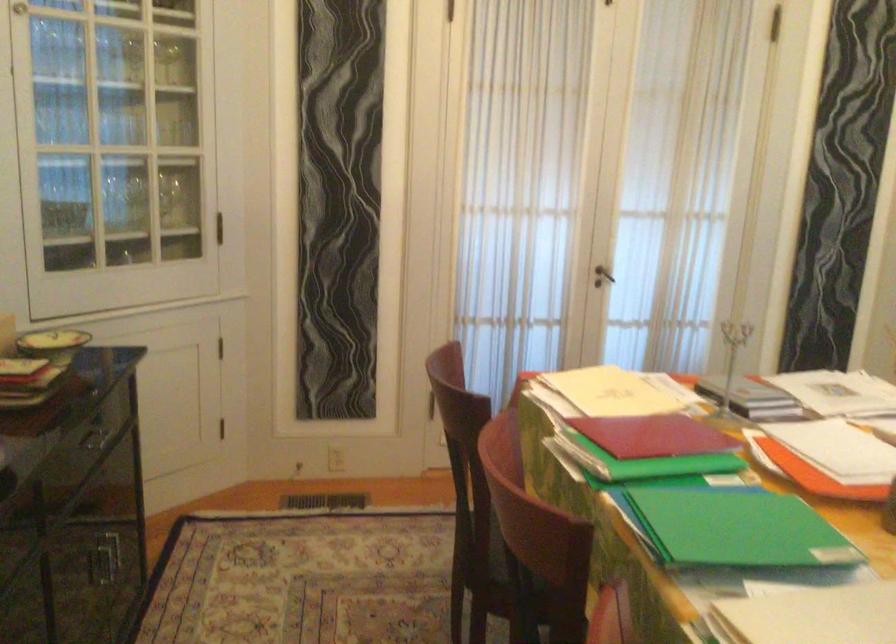
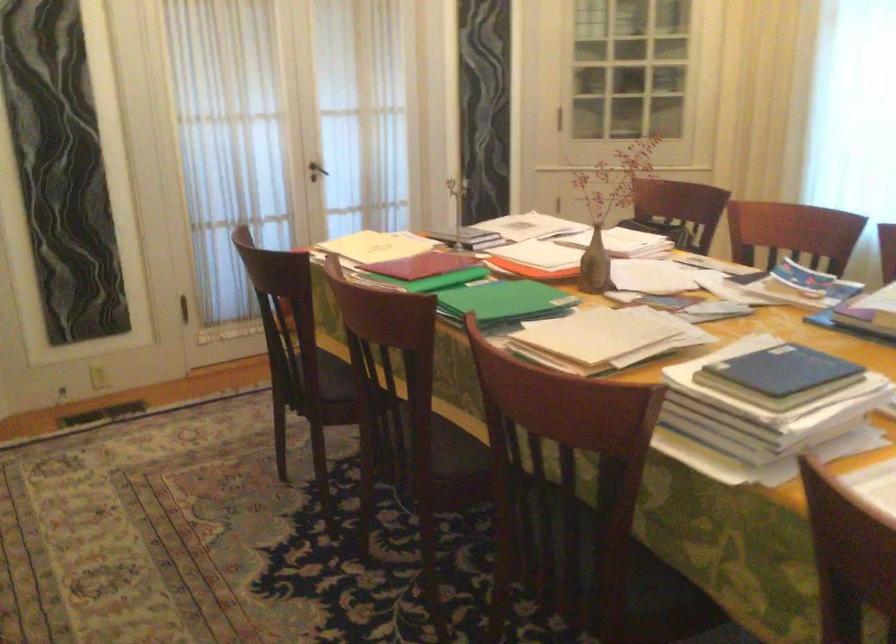
The point at (650, 437) is marked in the first image. Where is the corresponding point in the second image?

(423, 265)